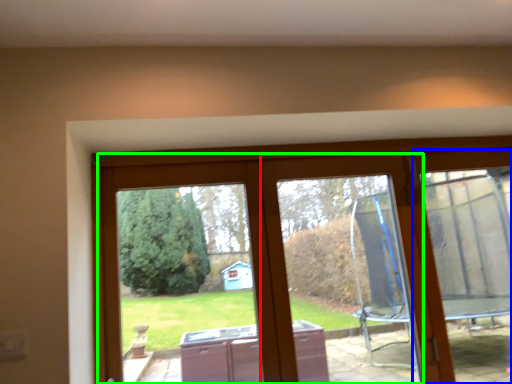
Question: Which object is positioned farthest from window frame (highlighted by a red box)? Select from screen door (highlighted by a blue box) and glass door (highlighted by a green box).

Choices:
 (A) screen door
 (B) glass door

Answer: (A)